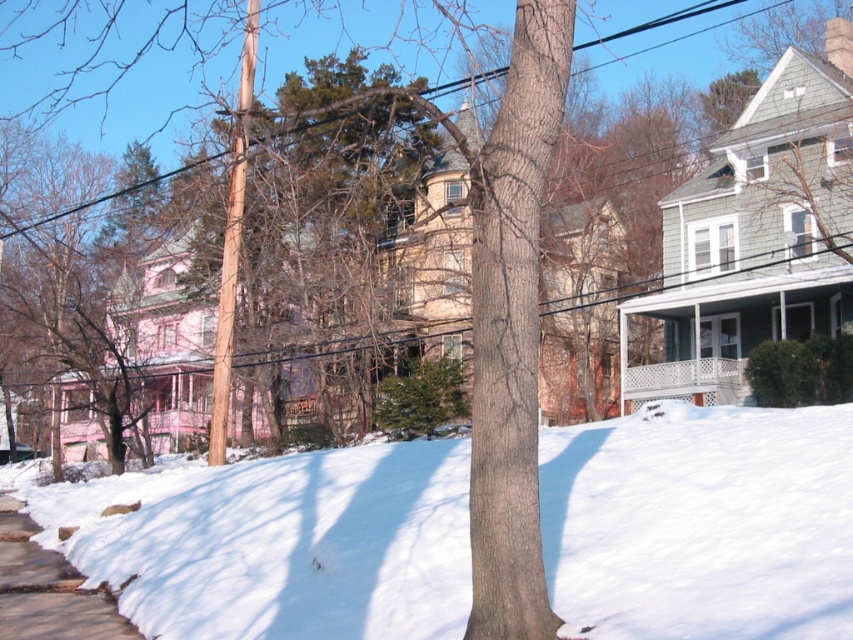
You are a snowplow driver trying to clear the sidewalk. You see the white fluffy snow at lower center and the smooth concrete sidewalk at lower left. Which area should you focus on first to ensure the sidewalk is accessible?

You should focus on clearing the white fluffy snow at lower center first because it is in front of the smooth concrete sidewalk at lower left, blocking access to it.

You are a snowplow driver and need to clear the snow from the white fluffy snow at lower center and the smooth concrete sidewalk at lower left. Which area requires more time to clear based on their sizes?

The white fluffy snow at lower center requires more time to clear because it is bigger than the smooth concrete sidewalk at lower left.